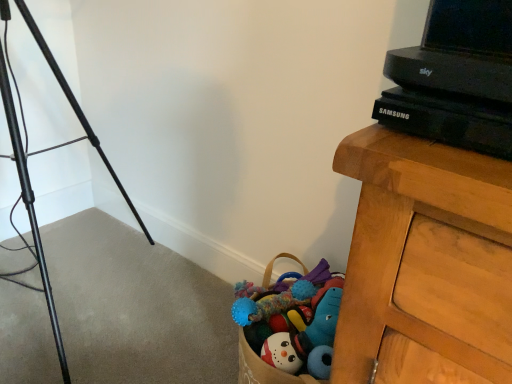
Question: Is black plastic tv at upper right positioned before black metal tripod at left?

Choices:
 (A) yes
 (B) no

Answer: (A)

Question: From a real-world perspective, is black plastic tv at upper right located beneath black metal tripod at left?

Choices:
 (A) no
 (B) yes

Answer: (A)

Question: Considering the relative positions of black plastic tv at upper right and black metal tripod at left in the image provided, is black plastic tv at upper right to the right of black metal tripod at left from the viewer's perspective?

Choices:
 (A) yes
 (B) no

Answer: (A)

Question: Is black plastic tv at upper right not close to black metal tripod at left?

Choices:
 (A) no
 (B) yes

Answer: (B)

Question: Is black plastic tv at upper right to the left of black metal tripod at left from the viewer's perspective?

Choices:
 (A) yes
 (B) no

Answer: (B)

Question: Considering the relative sizes of black plastic tv at upper right and black metal tripod at left in the image provided, is black plastic tv at upper right wider than black metal tripod at left?

Choices:
 (A) no
 (B) yes

Answer: (A)

Question: From a real-world perspective, is black metal tripod at left physically below black plastic tv at upper right?

Choices:
 (A) no
 (B) yes

Answer: (B)

Question: Can you confirm if black metal tripod at left is thinner than black plastic tv at upper right?

Choices:
 (A) yes
 (B) no

Answer: (B)

Question: Considering the relative sizes of black metal tripod at left and black plastic tv at upper right in the image provided, is black metal tripod at left smaller than black plastic tv at upper right?

Choices:
 (A) no
 (B) yes

Answer: (A)

Question: Are black metal tripod at left and black plastic tv at upper right beside each other?

Choices:
 (A) no
 (B) yes

Answer: (A)

Question: Can you confirm if black metal tripod at left is taller than black plastic tv at upper right?

Choices:
 (A) yes
 (B) no

Answer: (A)

Question: Considering the relative sizes of black metal tripod at left and black plastic tv at upper right in the image provided, is black metal tripod at left bigger than black plastic tv at upper right?

Choices:
 (A) no
 (B) yes

Answer: (B)

Question: From the image's perspective, is black metal tripod at left positioned above or below black plastic tv at upper right?

Choices:
 (A) above
 (B) below

Answer: (B)